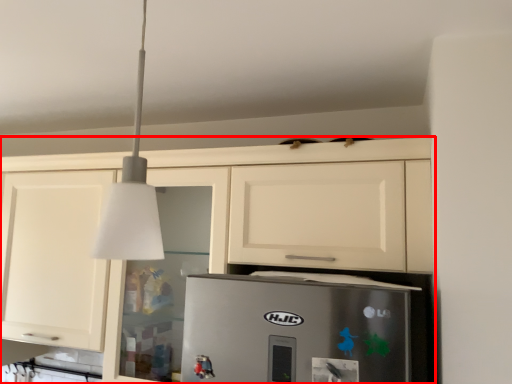
Question: In this image, where is cabinetry (annotated by the red box) located relative to light fixture?

Choices:
 (A) left
 (B) right

Answer: (A)